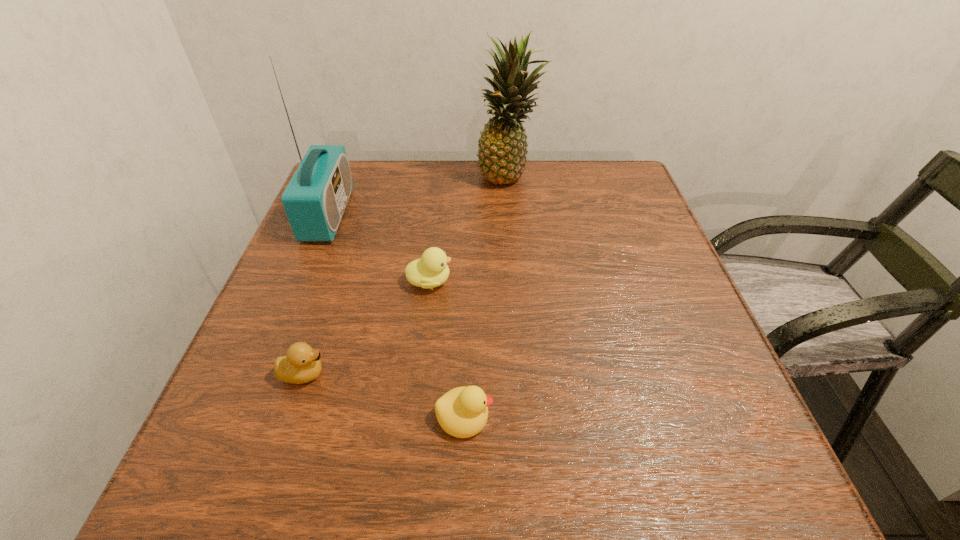
The width and height of the screenshot is (960, 540). I want to click on free space located 0.140m on the face of the nearest object, so click(x=583, y=416).

The image size is (960, 540). In order to click on pineapple situated at the far edge in this screenshot , I will do `click(502, 146)`.

You are a GUI agent. You are given a task and a screenshot of the screen. Output one action in this format:
    pyautogui.click(x=<x>, y=<y>)
    Task: Click on the radio receiver located in the far edge section of the desktop
    Image resolution: width=960 pixels, height=540 pixels.
    Given the screenshot: What is the action you would take?
    pyautogui.click(x=315, y=199)

Find the location of a particular element. radio receiver located in the left edge section of the desktop is located at coordinates (315, 199).

Identify the location of duckling present at the left edge. (302, 364).

This screenshot has height=540, width=960. I want to click on object at the far left corner, so click(x=315, y=199).

Locate an element on the screen. Image resolution: width=960 pixels, height=540 pixels. vacant space at the near edge of the desktop is located at coordinates (508, 474).

The height and width of the screenshot is (540, 960). What are the coordinates of `free space at the left edge` in the screenshot? It's located at (344, 295).

This screenshot has width=960, height=540. In the image, there is a desktop. What are the coordinates of `free region at the right edge` in the screenshot? It's located at (752, 425).

The image size is (960, 540). In order to click on blank space at the far left corner of the desktop in this screenshot , I will do pyautogui.click(x=373, y=169).